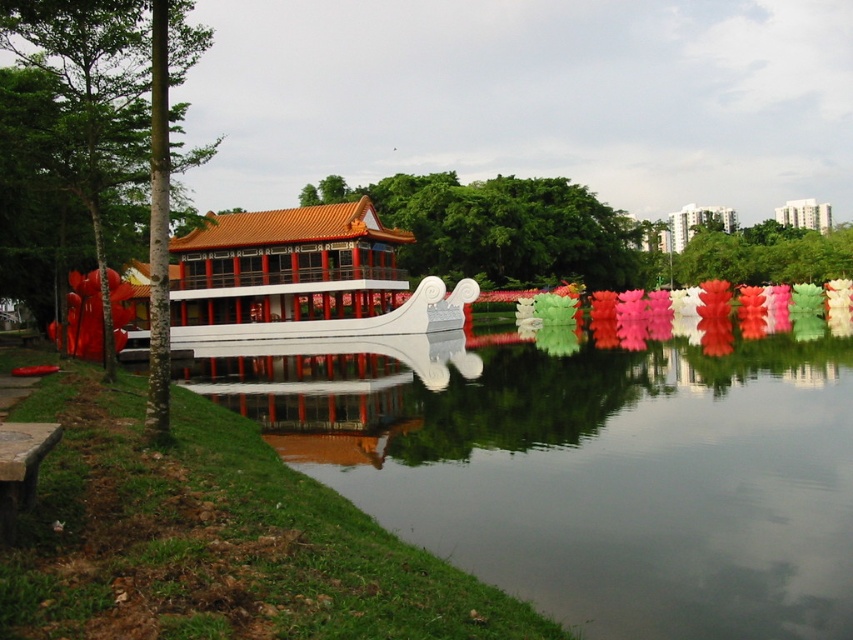
Question: Is green leafy tree at center in front of green matte tree at upper center?

Choices:
 (A) no
 (B) yes

Answer: (B)

Question: Is green smooth tree at left thinner than white glossy building at upper right?

Choices:
 (A) yes
 (B) no

Answer: (B)

Question: Among these objects, which one is nearest to the camera?

Choices:
 (A) matte orange temple at upper center
 (B) white glossy bridge at center
 (C) transparent water at center
 (D) green matte tree at upper center

Answer: (C)

Question: Is transparent water at center behind white glossy boat at center?

Choices:
 (A) no
 (B) yes

Answer: (A)

Question: Which point appears farthest from the camera in this image?

Choices:
 (A) (589, 189)
 (B) (701, 259)
 (C) (347, 326)

Answer: (A)

Question: Estimate the real-world distances between objects in this image. Which object is closer to the green matte tree at upper center?

Choices:
 (A) green leafy tree at center
 (B) white glossy building at upper right
 (C) transparent water at center

Answer: (A)